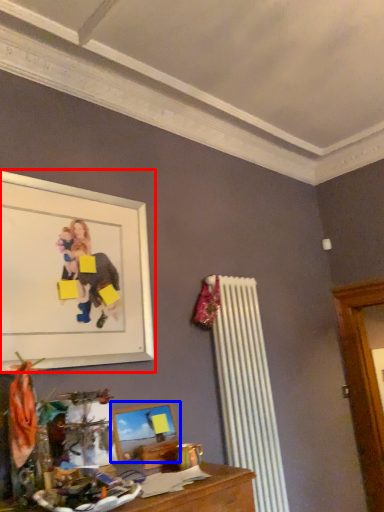
Question: Which of the following is the farthest to the observer, picture frame (highlighted by a red box) or picture frame (highlighted by a blue box)?

Choices:
 (A) picture frame
 (B) picture frame

Answer: (B)